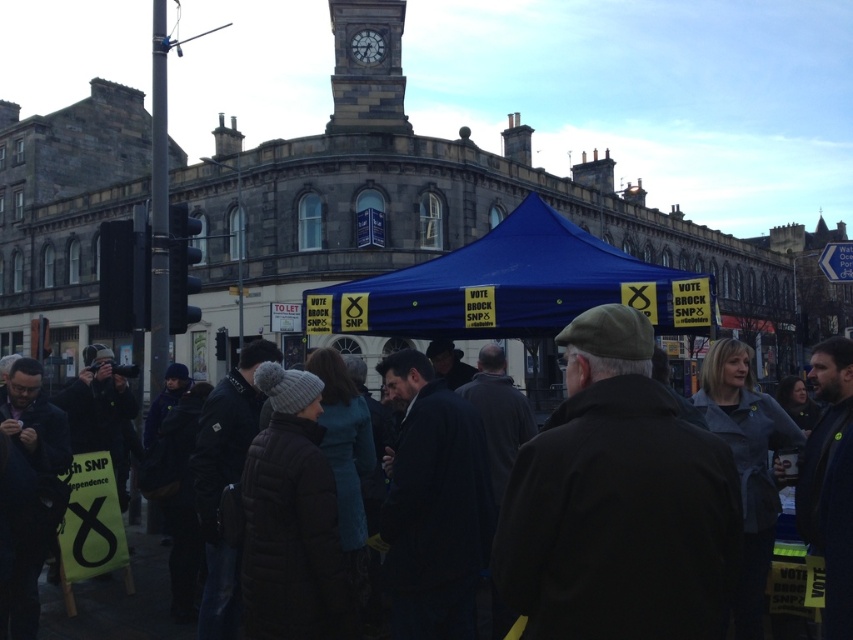
Can you confirm if dark brown woolen coat at center is positioned below dark gray stone clock at upper center?

Indeed, dark brown woolen coat at center is positioned under dark gray stone clock at upper center.

Can you confirm if dark brown woolen coat at center is positioned to the left of dark gray stone clock at upper center?

No, dark brown woolen coat at center is not to the left of dark gray stone clock at upper center.

Find the location of a particular element. dark brown woolen coat at center is located at coordinates (618, 502).

Who is more distant from viewer, (390, 84) or (366, 58)?

The point (366, 58) is more distant.

Where is `stone clock tower at upper center`? This screenshot has width=853, height=640. stone clock tower at upper center is located at coordinates point(367,67).

Where is `stone clock tower at upper center`? stone clock tower at upper center is located at coordinates (367, 67).

Between dark brown woolen coat at center and stone clock tower at upper center, which one appears on the left side from the viewer's perspective?

Positioned to the left is stone clock tower at upper center.

Identify the location of dark brown woolen coat at center. (618, 502).

Is point (712, 504) farther from camera compared to point (367, 116)?

No, it is in front of (367, 116).

Find the location of a particular element. dark brown woolen coat at center is located at coordinates (618, 502).